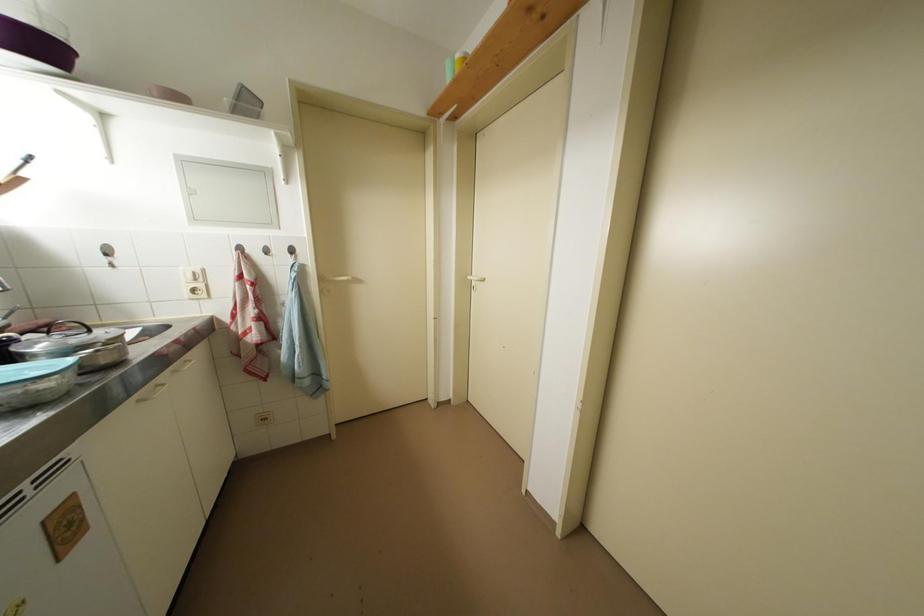
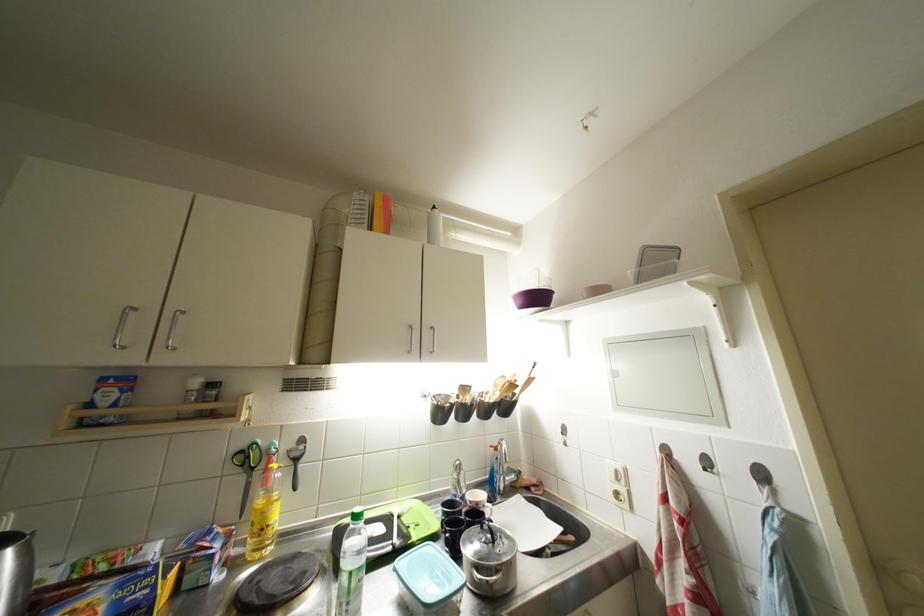
Where in the second image is the point corresponding to pixel 298 254 from the first image?

(769, 479)